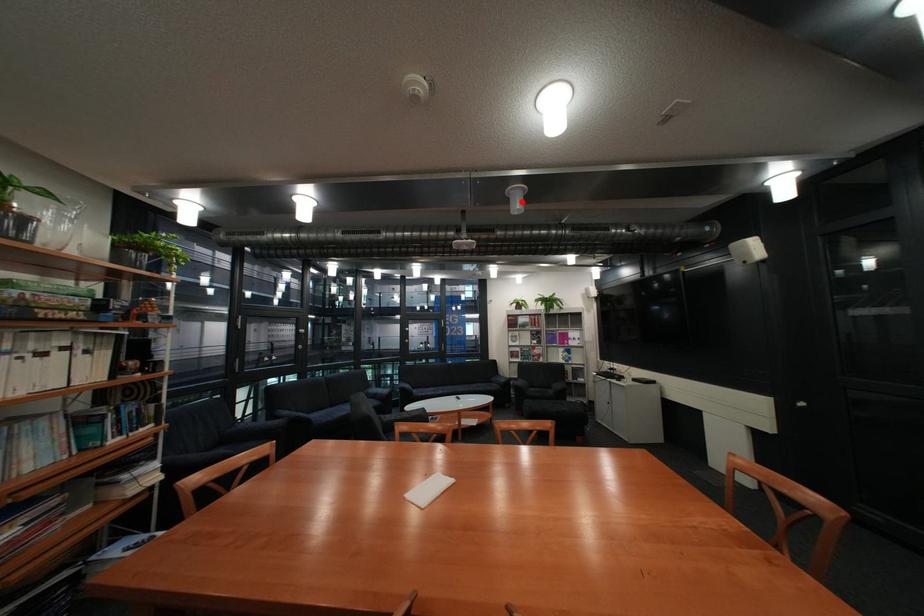
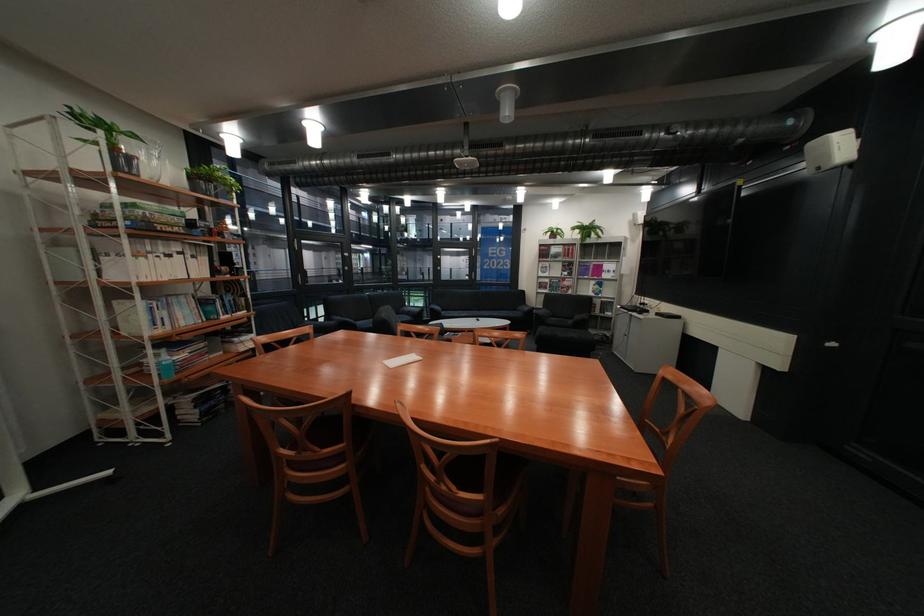
Question: I am providing you with two images of the same scene from different viewpoints. A red point is shown in image1. For the corresponding object point in image2, is it positioned nearer or farther from the camera?

Choices:
 (A) Nearer
 (B) Farther

Answer: (B)